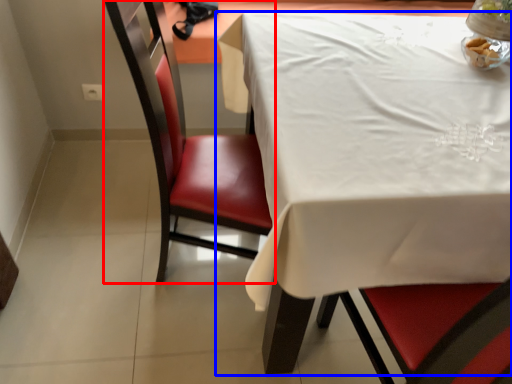
Question: Which object is further to the camera taking this photo, chair (highlighted by a red box) or table (highlighted by a blue box)?

Choices:
 (A) chair
 (B) table

Answer: (A)